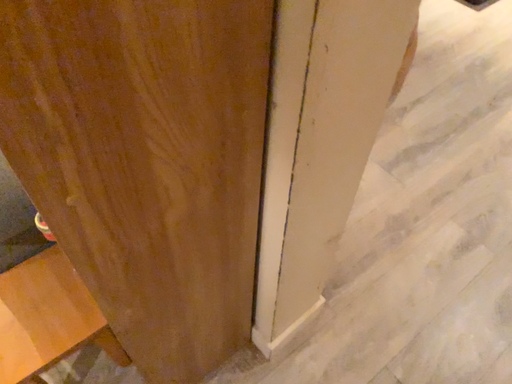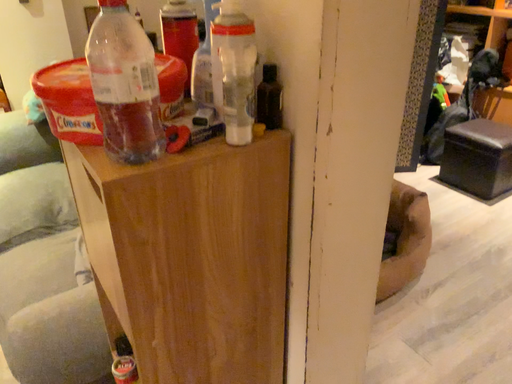
Question: How did the camera likely rotate when shooting the video?

Choices:
 (A) rotated downward
 (B) rotated upward

Answer: (B)